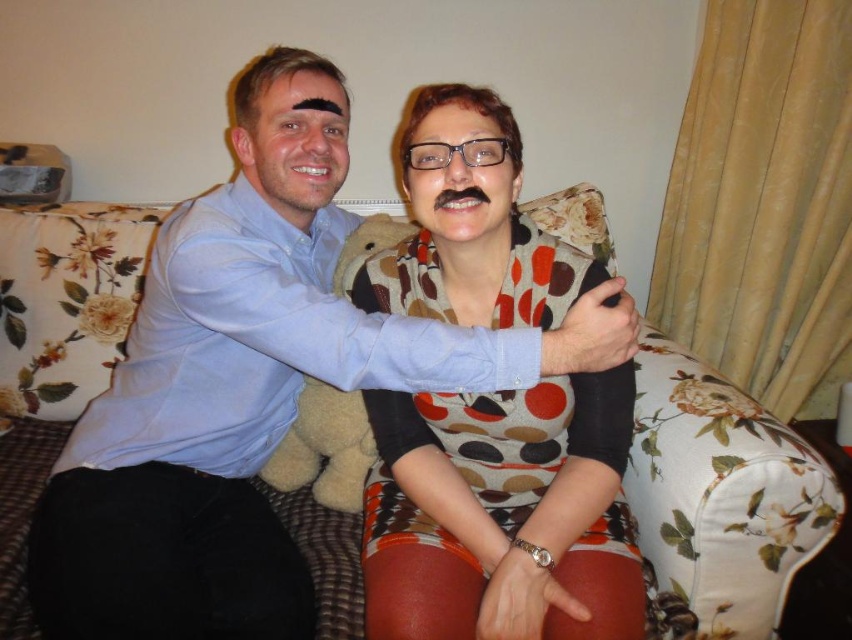
In the scene shown: Is polka dot sweater at center in front of fuzzy beige teddy bear at center?

Yes, it is.

Can you confirm if polka dot sweater at center is taller than fuzzy beige teddy bear at center?

Yes, polka dot sweater at center is taller than fuzzy beige teddy bear at center.

Is point (490, 225) more distant than point (324, 426)?

No, (490, 225) is closer to viewer.

Image resolution: width=852 pixels, height=640 pixels. I want to click on polka dot sweater at center, so click(x=511, y=480).

Does point (350, 616) lie in front of point (433, 148)?

No, (350, 616) is behind (433, 148).

Is point (773, 568) farther from viewer compared to point (491, 552)?

Yes.

Does point (9, 348) come farther from viewer compared to point (522, 612)?

That is True.

Where is `floral fabric couch at center`? The width and height of the screenshot is (852, 640). floral fabric couch at center is located at coordinates (718, 500).

Can you confirm if floral fabric couch at center is bigger than fuzzy beige teddy bear at center?

Correct, floral fabric couch at center is larger in size than fuzzy beige teddy bear at center.

Between point (42, 292) and point (331, 460), which one is positioned in front?

Point (331, 460) is in front.

In order to click on floral fabric couch at center in this screenshot , I will do `click(718, 500)`.